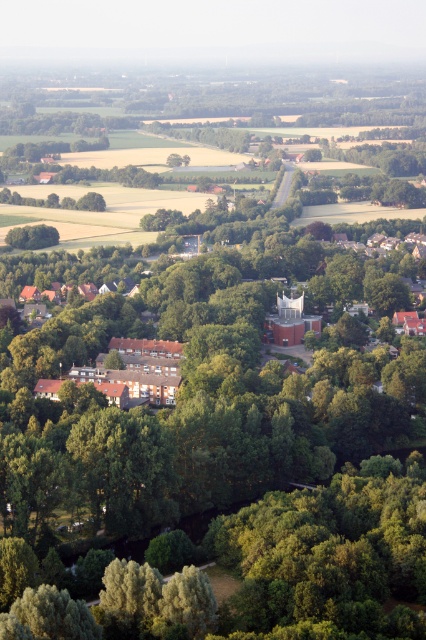
You are a drone operator planning to fly a drone from the brown wooden houses at lower left to the green leafy tree at lower left. Given that the drone has a maximum flight range of 150 meters, will it be able to reach the tree without needing to recharge?

The brown wooden houses at lower left and green leafy tree at lower left are 158.82 meters apart from each other. Since the drone can only fly 150 meters before needing to recharge, it will not be able to reach the tree without recharging.

You are a drone operator flying over a rural area and need to deliver a package to the brown wooden houses at lower left. There is a green leafy tree at lower left in the way. Can the drone safely navigate around the tree to reach the houses?

The brown wooden houses at lower left is larger in size than green leafy tree at lower left. Therefore, the drone can safely navigate around the green leafy tree at lower left to reach the brown wooden houses at lower left since the houses are bigger and provide more space for maneuvering.

You are a delivery drone flying over a rural area. Your GPS shows a delivery point at coordinates [137,371]. According to the image, what type of structure is located at that point?

The point at coordinates [137,371] marks brown wooden houses at lower left.